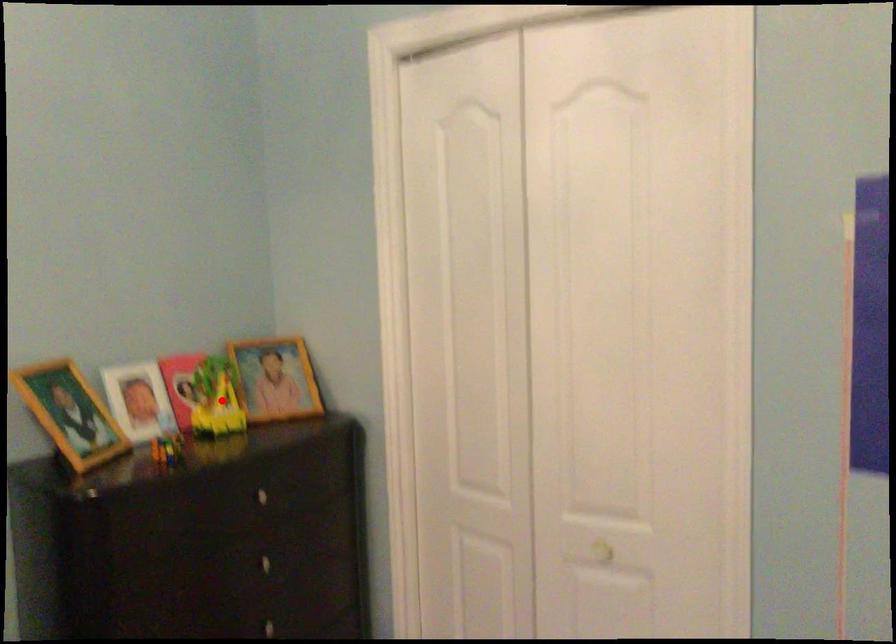
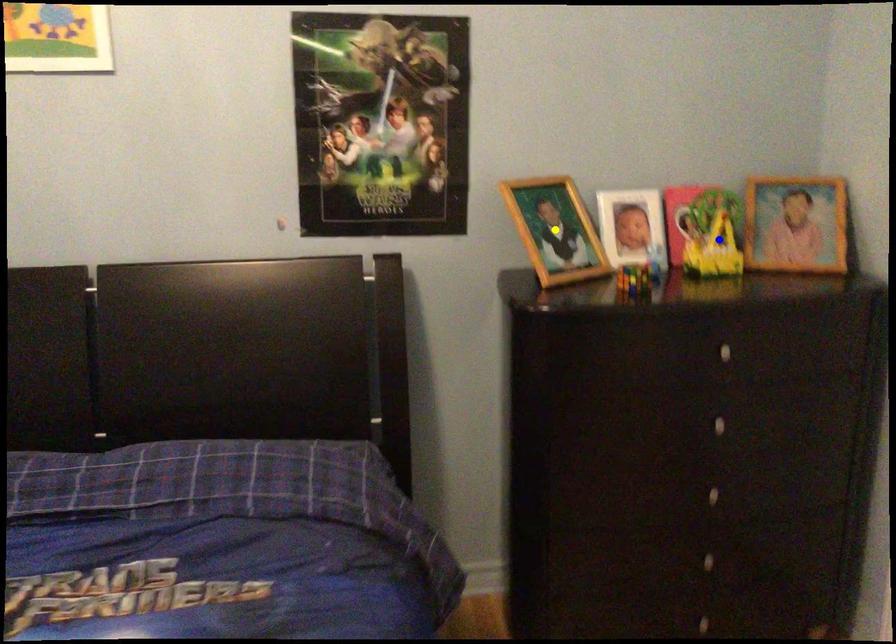
Question: I am providing you with two images of the same scene from different viewpoints. A red point is marked on the first image. You are given multiple points on the second image. Which mark in image 2 goes with the point in image 1?

Choices:
 (A) blue point
 (B) green point
 (C) yellow point

Answer: (A)